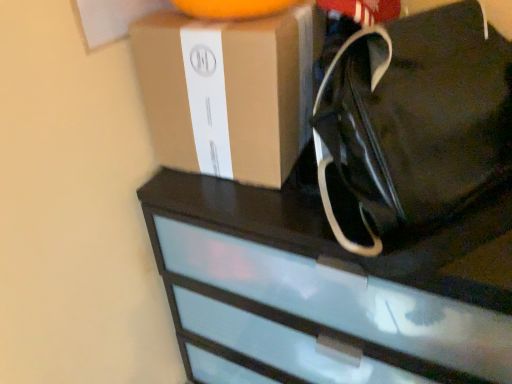
Question: Is black fabric tote at upper right wider than black glossy chest of drawers at upper center?

Choices:
 (A) no
 (B) yes

Answer: (A)

Question: From a real-world perspective, is black fabric tote at upper right located beneath black glossy chest of drawers at upper center?

Choices:
 (A) yes
 (B) no

Answer: (B)

Question: From the image's perspective, does black fabric tote at upper right appear lower than black glossy chest of drawers at upper center?

Choices:
 (A) yes
 (B) no

Answer: (B)

Question: Does black fabric tote at upper right lie in front of black glossy chest of drawers at upper center?

Choices:
 (A) no
 (B) yes

Answer: (B)

Question: Would you say black fabric tote at upper right contains black glossy chest of drawers at upper center?

Choices:
 (A) no
 (B) yes

Answer: (A)

Question: Does black fabric tote at upper right turn towards black glossy chest of drawers at upper center?

Choices:
 (A) yes
 (B) no

Answer: (B)

Question: Is brown cardboard box at upper center smaller than black fabric tote at upper right?

Choices:
 (A) no
 (B) yes

Answer: (B)

Question: Could you tell me if brown cardboard box at upper center is facing black fabric tote at upper right?

Choices:
 (A) no
 (B) yes

Answer: (A)

Question: From the image's perspective, is brown cardboard box at upper center above black fabric tote at upper right?

Choices:
 (A) no
 (B) yes

Answer: (B)

Question: Does brown cardboard box at upper center have a greater height compared to black fabric tote at upper right?

Choices:
 (A) no
 (B) yes

Answer: (A)

Question: Does brown cardboard box at upper center have a lesser height compared to black fabric tote at upper right?

Choices:
 (A) no
 (B) yes

Answer: (B)

Question: From a real-world perspective, is brown cardboard box at upper center beneath black fabric tote at upper right?

Choices:
 (A) yes
 (B) no

Answer: (A)

Question: From a real-world perspective, is black fabric tote at upper right under brown cardboard box at upper center?

Choices:
 (A) no
 (B) yes

Answer: (A)